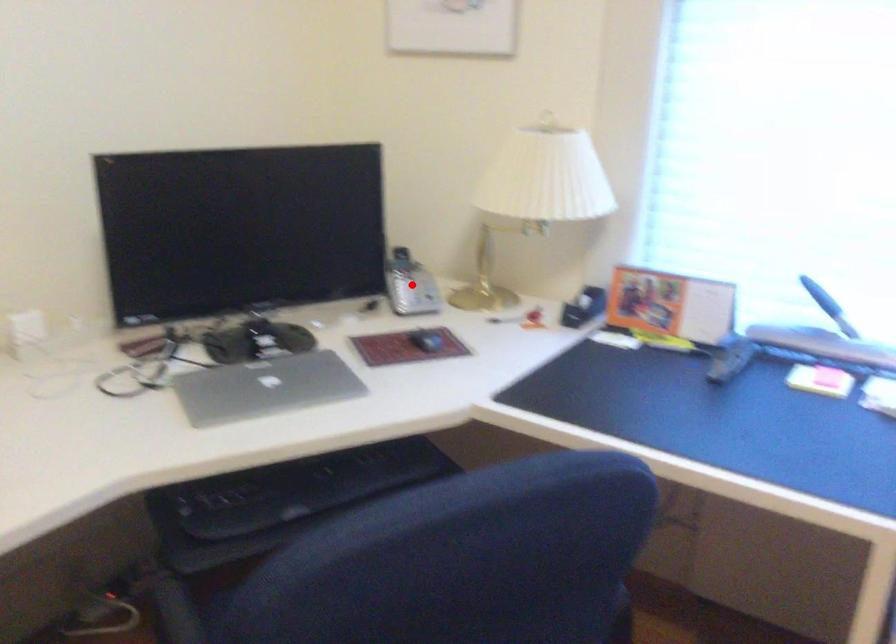
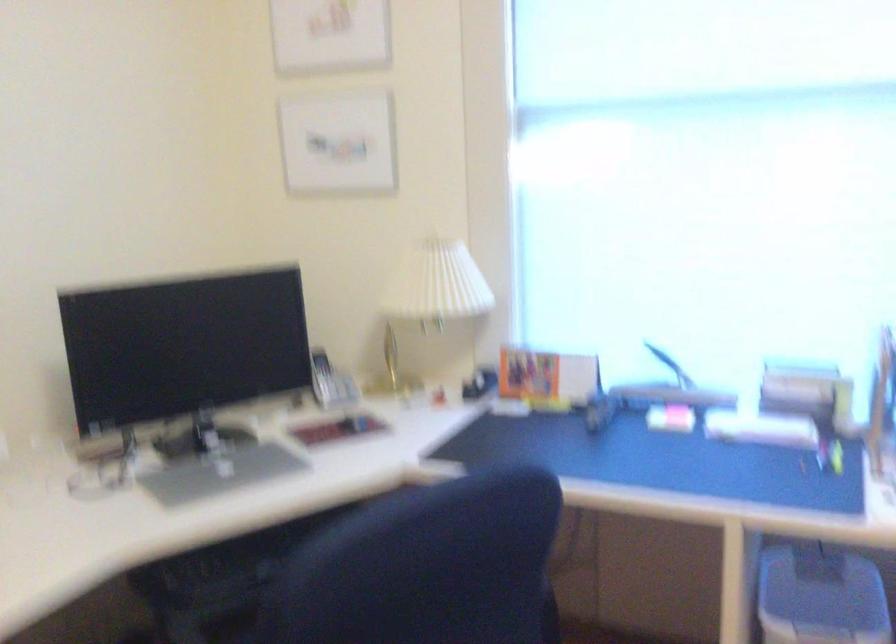
The point at the highlighted location is marked in the first image. Where is the corresponding point in the second image?

(330, 382)